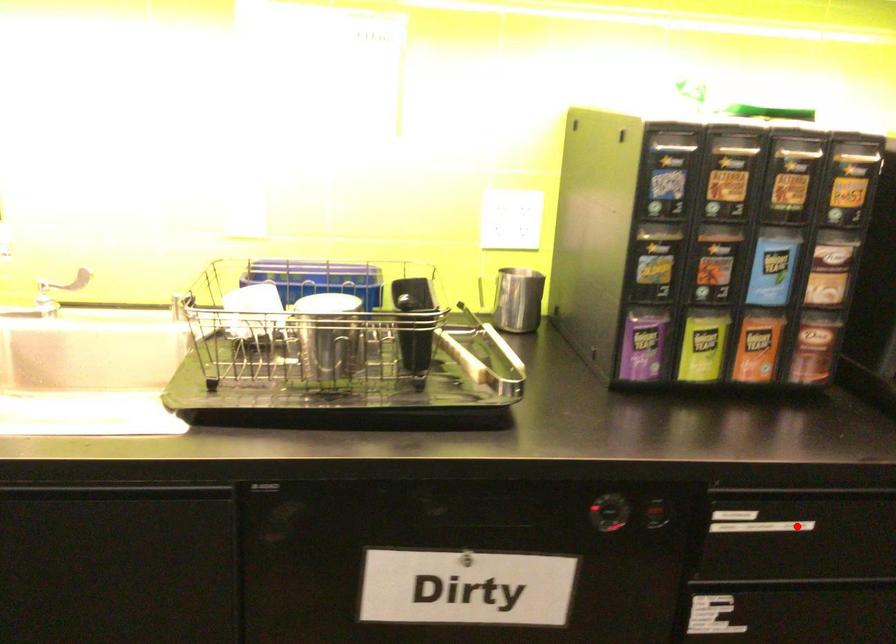
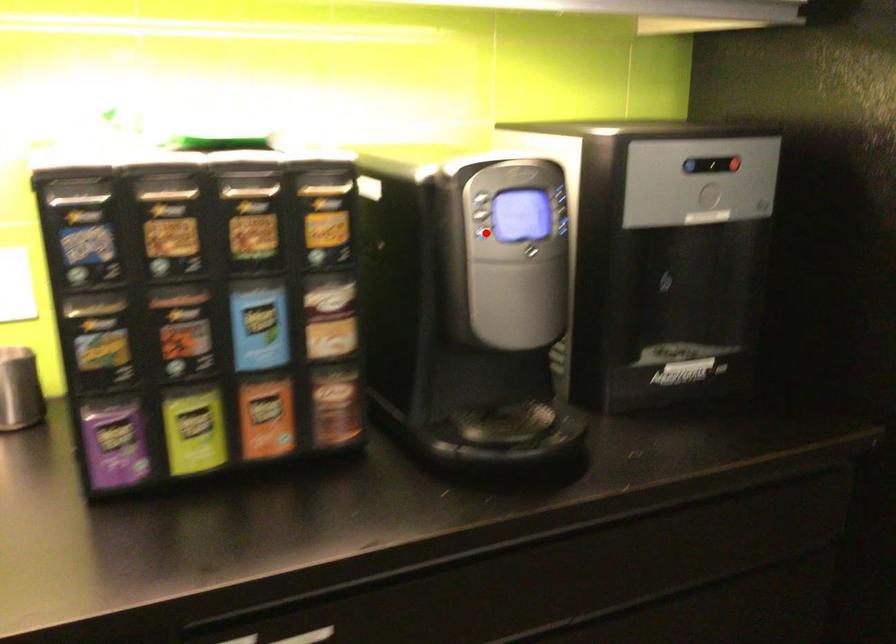
I am providing you with two images of the same scene from different viewpoints. A red point is marked on the first image and another point is marked on the second image. Are the points marked in image1 and image2 representing the same 3D position?

No